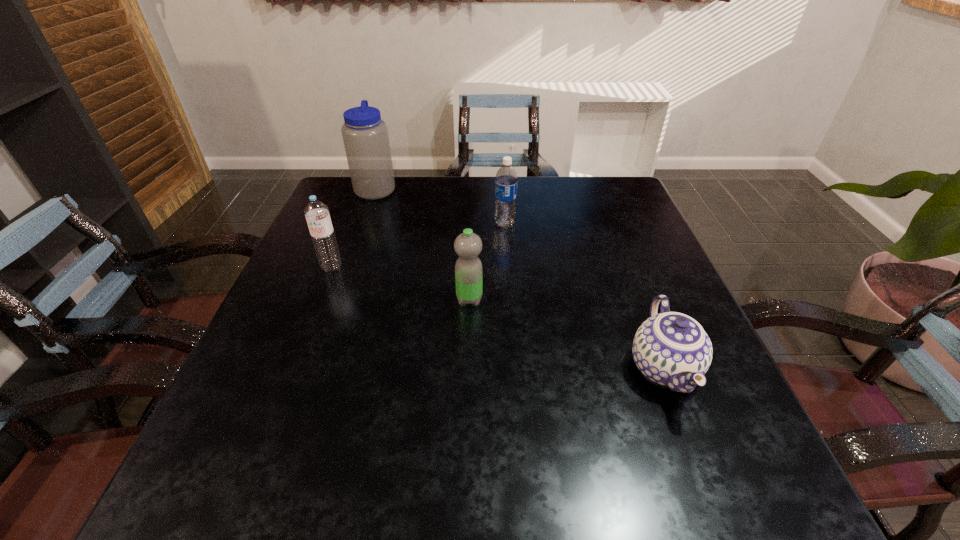
The height and width of the screenshot is (540, 960). I want to click on the tallest object, so click(x=365, y=136).

I want to click on the farthest object, so click(x=365, y=136).

The height and width of the screenshot is (540, 960). What are the coordinates of `the second object from right to left` in the screenshot? It's located at (506, 181).

At what (x,y) coordinates should I click in order to perform the action: click on the rightmost water bottle. Please return your answer as a coordinate pair (x, y). Image resolution: width=960 pixels, height=540 pixels. Looking at the image, I should click on (506, 181).

Locate an element on the screen. the third farthest object is located at coordinates (317, 215).

Find the location of a particular element. the second water bottle from right to left is located at coordinates (468, 268).

Find the location of a particular element. Image resolution: width=960 pixels, height=540 pixels. the third object from right to left is located at coordinates (468, 268).

I want to click on the nearest object, so point(672,349).

I want to click on the shortest object, so click(672, 349).

At what (x,y) coordinates should I click in order to perform the action: click on free space located with a carrying loop on the side of the farthest object. Please return your answer as a coordinate pair (x, y). This screenshot has width=960, height=540. Looking at the image, I should click on (516, 188).